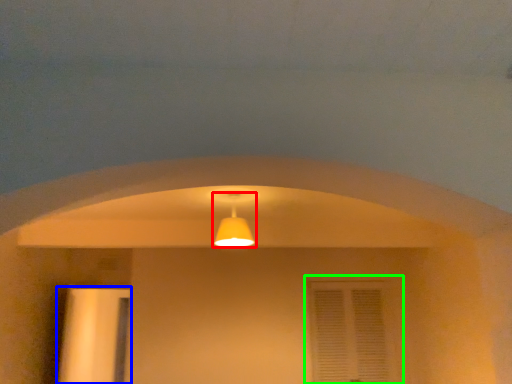
Question: Considering the real-world distances, which object is farthest from lamp (highlighted by a red box)? door (highlighted by a blue box) or window (highlighted by a green box)?

Choices:
 (A) door
 (B) window

Answer: (A)